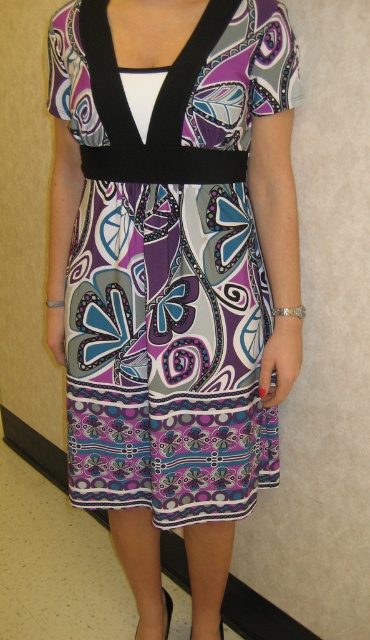
You are a fashion designer analyzing the dress design. You notice a point at coordinates (167, 611) on the dress image. What object is located at this point?

The point at coordinates (167, 611) indicates a matte black sandal at lower center.

You are an interior designer planning to place a sofa in a room. You have a purple printed dress at center that needs to be displayed in the same area. Given the coordinates of the dress, can you confirm if there is enough space to place the sofa without overlapping?

The purple printed dress at center is located at point (169, 264). Since the coordinates indicate its position, you need to ensure the sofa placement avoids this area to prevent overlap. However, without knowing the sofa dimensions or room layout details, it is impossible to confirm space availability definitively.